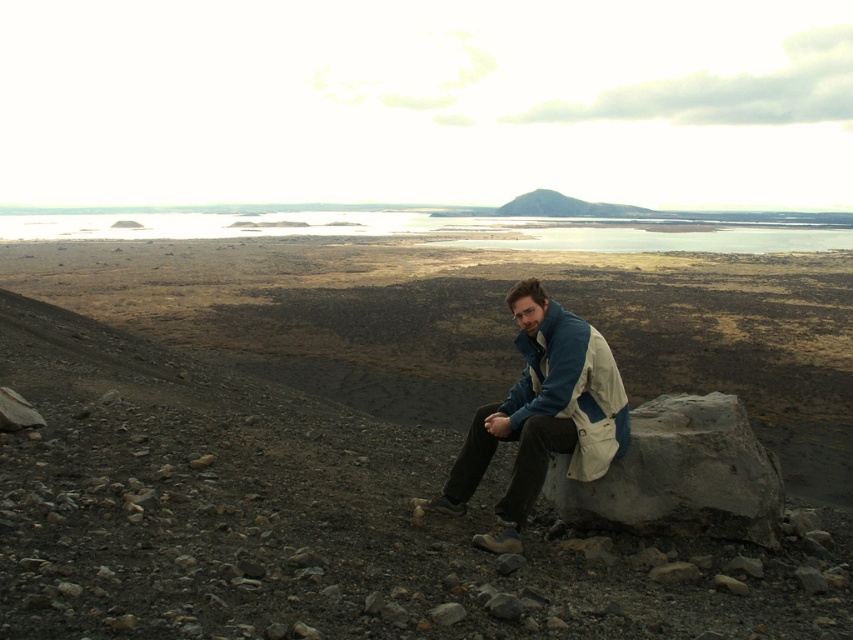
Question: Is blue fabric jacket at center smaller than blue/white fabric jacket at center?

Choices:
 (A) yes
 (B) no

Answer: (B)

Question: Which of the following is the farthest from the observer?

Choices:
 (A) (741, 378)
 (B) (564, 440)
 (C) (624, 413)

Answer: (A)

Question: Considering the relative positions of gray gravel at center and blue fabric jacket at center in the image provided, where is gray gravel at center located with respect to blue fabric jacket at center?

Choices:
 (A) below
 (B) above

Answer: (B)

Question: Which of the following is the closest to the observer?

Choices:
 (A) gray rough rock at lower right
 (B) blue fabric jacket at center
 (C) blue/white fabric jacket at center

Answer: (B)

Question: Estimate the real-world distances between objects in this image. Which object is closer to the blue fabric jacket at center?

Choices:
 (A) blue/white fabric jacket at center
 (B) gray gravel at center

Answer: (A)

Question: Where is gray gravel at center located in relation to blue fabric jacket at center in the image?

Choices:
 (A) above
 (B) below

Answer: (A)